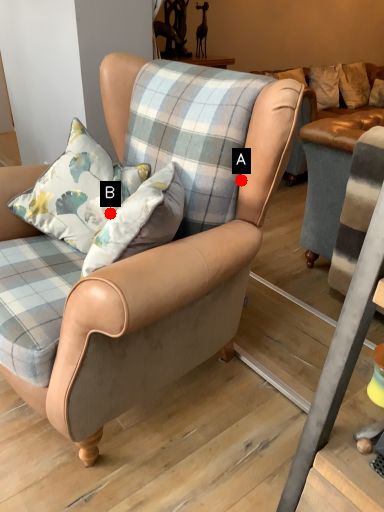
Question: Two points are circled on the image, labeled by A and B beside each circle. Which point is farther from the camera taking this photo?

Choices:
 (A) A is further
 (B) B is further

Answer: (B)